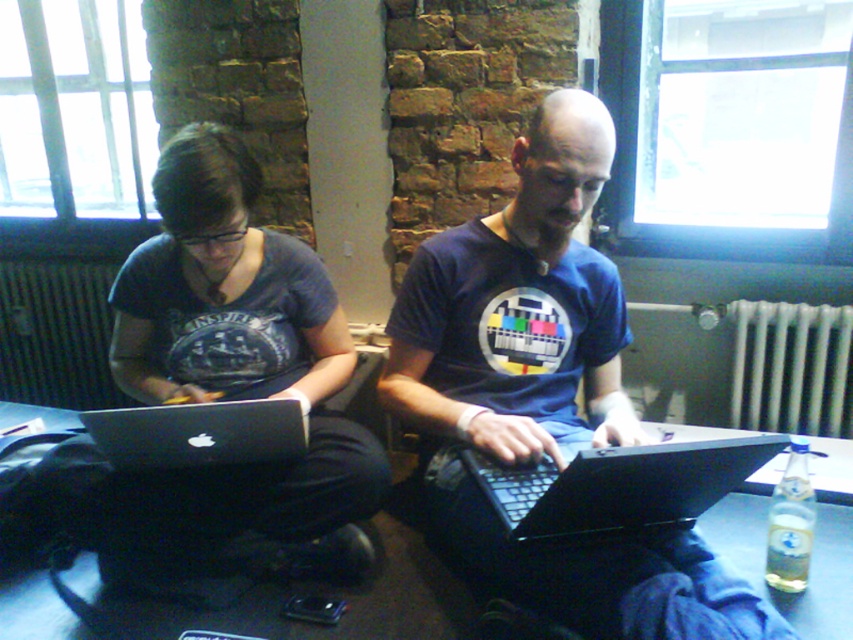
You are a delivery person who needs to place a small package on the table between the white metallic radiator at right and the silver metallic laptop at center. Is there enough space for the package?

The silver metallic laptop at center is behind the white metallic radiator at right, so there is space between them for the package.

You are a photographer setting up a shoot in this workspace. You want to place a small reflector between the matte black laptop at center and the white metallic radiator at right to bounce light onto the subjects. Considering their positions, where should you position the reflector?

The matte black laptop at center is positioned under the white metallic radiator at right, so you should place the reflector between them, below the radiator and above the laptop to effectively bounce light onto the subjects.

You need to place a large document on the table between the matte black laptop at center and the white metallic radiator at right. Considering their sizes, will the document fit without overlapping either object?

The matte black laptop at center is larger in size than the white metallic radiator at right, so there should be enough space between them to place the large document without overlapping either object.